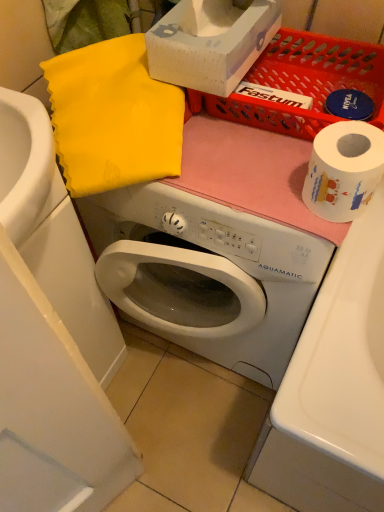
Question: From the image's perspective, is white glossy sink at lower left positioned above or below white paper at right?

Choices:
 (A) above
 (B) below

Answer: (B)

Question: Is white glossy sink at lower left wider or thinner than white paper at right?

Choices:
 (A) thin
 (B) wide

Answer: (B)

Question: Estimate the real-world distances between objects in this image. Which object is closer to the white cardboard box at upper center?

Choices:
 (A) white glossy sink at lower left
 (B) white paper at right

Answer: (B)

Question: Estimate the real-world distances between objects in this image. Which object is farther from the white cardboard box at upper center?

Choices:
 (A) white glossy sink at lower left
 (B) white paper at right

Answer: (A)